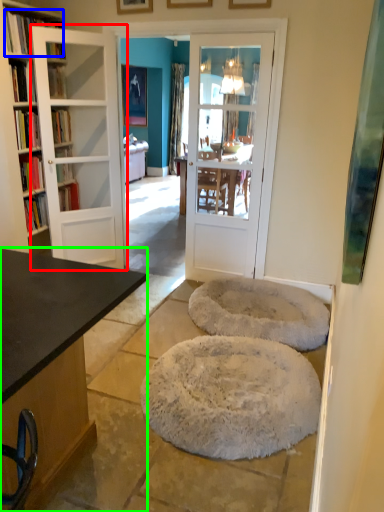
Question: Considering the real-world distances, which object is closest to door (highlighted by a red box)? book (highlighted by a blue box) or desk (highlighted by a green box).

Choices:
 (A) book
 (B) desk

Answer: (A)